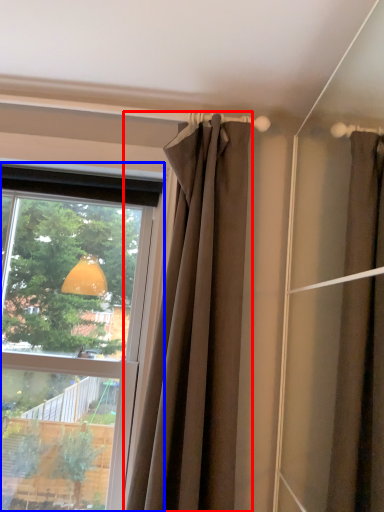
Question: Which object appears farthest to the camera in this image, curtain (highlighted by a red box) or window (highlighted by a blue box)?

Choices:
 (A) curtain
 (B) window

Answer: (B)